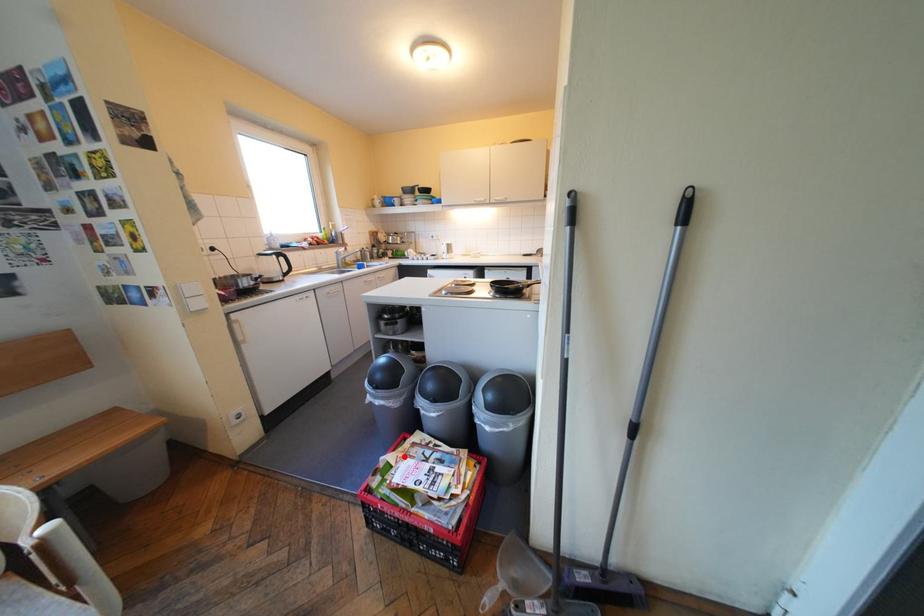
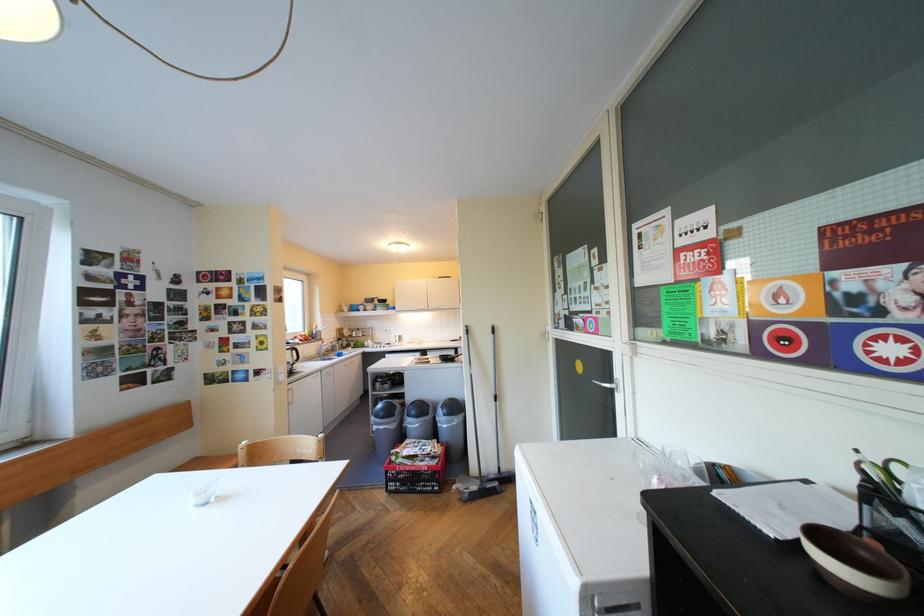
Locate, in the second image, the point that corresponds to the highlighted location in the first image.

(410, 448)